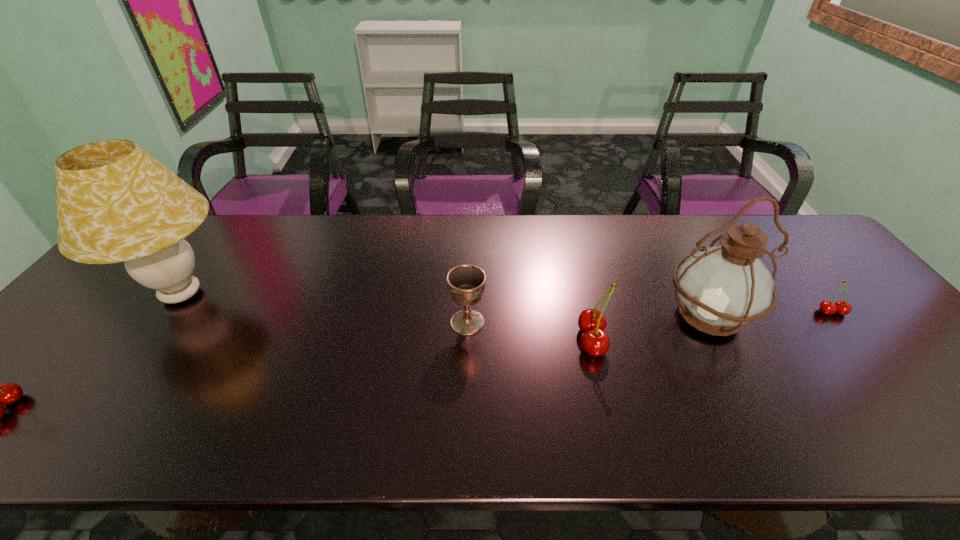
The image size is (960, 540). Identify the location of the second cherry from left to right. (595, 341).

At what (x,y) coordinates should I click in order to perform the action: click on the fourth object from left to right. Please return your answer as a coordinate pair (x, y). This screenshot has height=540, width=960. Looking at the image, I should click on (595, 341).

At what (x,y) coordinates should I click in order to perform the action: click on the farthest cherry. Please return your answer as a coordinate pair (x, y). Looking at the image, I should click on (826, 307).

Where is `the rightmost cherry`? the rightmost cherry is located at coordinates (826, 307).

I want to click on oil lamp, so click(721, 288).

Locate an element on the screen. chalice is located at coordinates (466, 283).

Where is `the fifth object from right to left`? The height and width of the screenshot is (540, 960). the fifth object from right to left is located at coordinates (115, 202).

You are a GUI agent. You are given a task and a screenshot of the screen. Output one action in this format:
    pyautogui.click(x=<x>, y=<y>)
    Task: Click on the free space located 0.380m with the stems of the fourth object from left to right pointing upwards
    The image size is (960, 540).
    Given the screenshot: What is the action you would take?
    tap(422, 341)

The width and height of the screenshot is (960, 540). In order to click on vacant region located 0.110m with the stems of the fourth object from left to right pointing upwards in this screenshot , I will do `click(533, 341)`.

Where is `vacant area situated with the stems of the fourth object from left to right pointing upwards`? This screenshot has height=540, width=960. vacant area situated with the stems of the fourth object from left to right pointing upwards is located at coordinates 520,341.